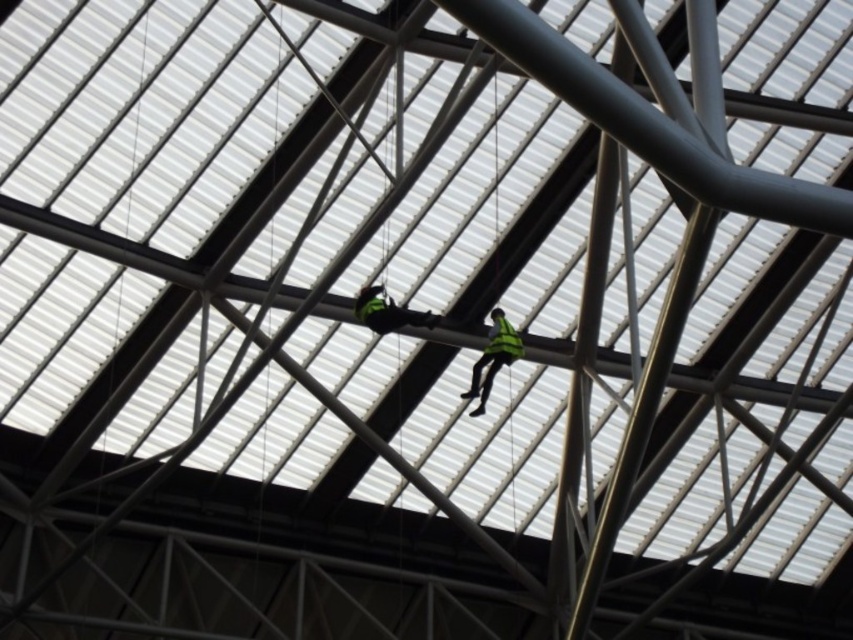
Who is shorter, green reflective vest at upper center or green reflective vest at center?

With less height is green reflective vest at center.

Does green reflective vest at upper center have a larger size compared to green reflective vest at center?

Indeed, green reflective vest at upper center has a larger size compared to green reflective vest at center.

Which is behind, point (471, 412) or point (425, 314)?

Point (471, 412)

This screenshot has height=640, width=853. In order to click on green reflective vest at upper center in this screenshot , I will do `click(492, 358)`.

Which is more to the left, green reflective vest at center or green matte safety vest at center?

Positioned to the left is green reflective vest at center.

What do you see at coordinates (387, 310) in the screenshot? I see `green reflective vest at center` at bounding box center [387, 310].

Identify the location of green reflective vest at center. The height and width of the screenshot is (640, 853). (x=387, y=310).

Is green reflective vest at upper center positioned at the back of green matte safety vest at center?

Yes, it is.

The height and width of the screenshot is (640, 853). I want to click on green reflective vest at upper center, so click(492, 358).